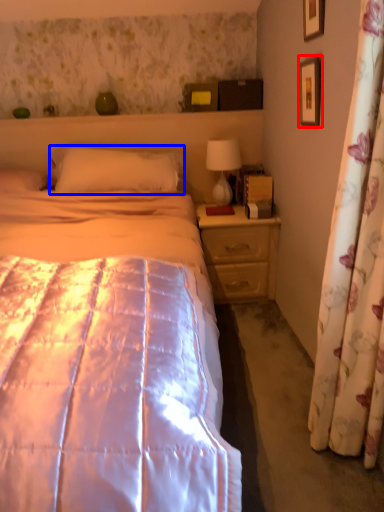
Question: Which object is further to the camera taking this photo, picture frame (highlighted by a red box) or pillow (highlighted by a blue box)?

Choices:
 (A) picture frame
 (B) pillow

Answer: (B)